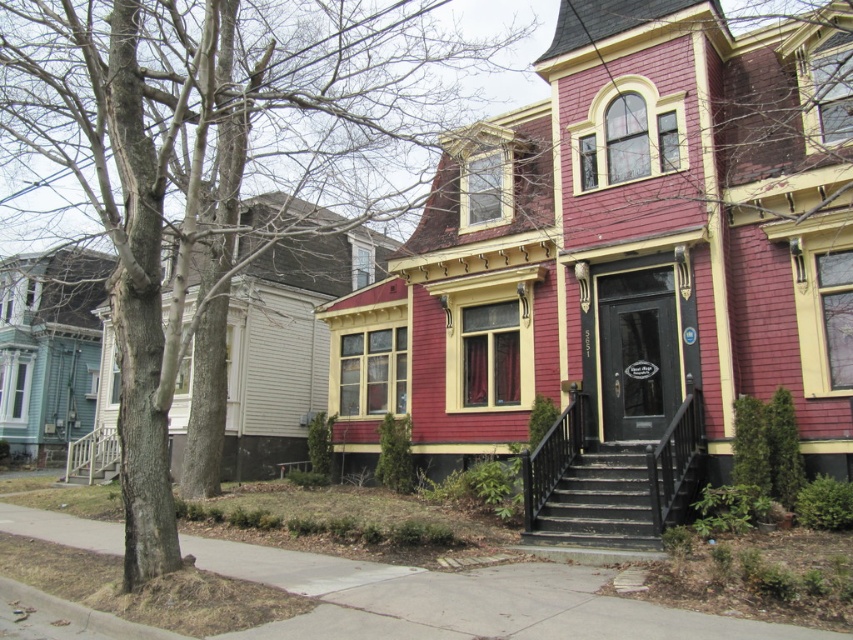
You are a delivery person approaching the Victorian house. You need to place a package on the concrete sidewalk at lower center. However, there is a brown bark tree at left in the way. Can you reach the sidewalk without moving the tree?

The concrete sidewalk at lower center is behind the brown bark tree at left, so you can walk around the tree to access the sidewalk from the side or the back of the tree.

You are standing at the entrance of the Victorian house and want to walk to the concrete sidewalk at lower center. Which direction should you head to reach it?

The concrete sidewalk at lower center is located at coordinates [463,600], so you should head towards the lower center direction to reach it.

You are a delivery person approaching the Victorian house. You need to reach the front door, which is located above the black wooden stairs at center. Can you walk directly to the front door from the concrete sidewalk at lower center without stepping onto any other surfaces?

The concrete sidewalk at lower center is positioned under the black wooden stairs at center, so you can walk directly to the front door from the concrete sidewalk at lower center without needing to step onto other surfaces.